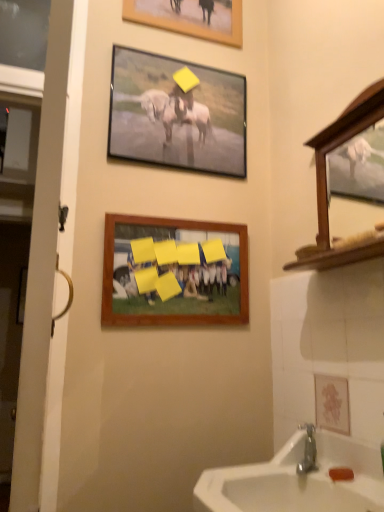
Question: From the image's perspective, is wooden picture frame at upper center, placed as the first picture frame when sorted from top to bottom, above metallic silver frame at upper center, which is the 2th picture frame from bottom to top?

Choices:
 (A) no
 (B) yes

Answer: (B)

Question: Is there a large distance between wooden picture frame at upper center, marked as the third picture frame in a bottom-to-top arrangement, and metallic silver frame at upper center, positioned as the 2th picture frame in top-to-bottom order?

Choices:
 (A) no
 (B) yes

Answer: (A)

Question: Is wooden picture frame at upper center, marked as the third picture frame in a bottom-to-top arrangement, oriented towards metallic silver frame at upper center, which is the 2th picture frame from bottom to top?

Choices:
 (A) no
 (B) yes

Answer: (A)

Question: Is wooden picture frame at upper center, marked as the third picture frame in a bottom-to-top arrangement, taller than metallic silver frame at upper center, which is the 2th picture frame from bottom to top?

Choices:
 (A) no
 (B) yes

Answer: (A)

Question: Is wooden picture frame at upper center, placed as the first picture frame when sorted from top to bottom, to the left of metallic silver frame at upper center, which is the 2th picture frame from bottom to top, from the viewer's perspective?

Choices:
 (A) no
 (B) yes

Answer: (A)

Question: In the image, is metallic silver frame at upper center, which is the 2th picture frame from bottom to top, positioned in front of or behind wooden picture frame at upper center, marked as the third picture frame in a bottom-to-top arrangement?

Choices:
 (A) behind
 (B) front

Answer: (B)

Question: From a real-world perspective, relative to wooden picture frame at upper center, marked as the third picture frame in a bottom-to-top arrangement, is metallic silver frame at upper center, which is the 2th picture frame from bottom to top, vertically above or below?

Choices:
 (A) below
 (B) above

Answer: (A)

Question: Is metallic silver frame at upper center, which is the 2th picture frame from bottom to top, wider or thinner than wooden picture frame at upper center, placed as the first picture frame when sorted from top to bottom?

Choices:
 (A) wide
 (B) thin

Answer: (A)

Question: From the image's perspective, is metallic silver frame at upper center, which is the 2th picture frame from bottom to top, located above or below wooden picture frame at upper center, marked as the third picture frame in a bottom-to-top arrangement?

Choices:
 (A) below
 (B) above

Answer: (A)

Question: From the image's perspective, is white wooden door at left positioned above or below metallic silver frame at upper center, which is the 2th picture frame from bottom to top?

Choices:
 (A) below
 (B) above

Answer: (A)

Question: Is white wooden door at left taller or shorter than metallic silver frame at upper center, positioned as the 2th picture frame in top-to-bottom order?

Choices:
 (A) short
 (B) tall

Answer: (B)

Question: Do you think white wooden door at left is within metallic silver frame at upper center, positioned as the 2th picture frame in top-to-bottom order, or outside of it?

Choices:
 (A) outside
 (B) inside

Answer: (A)

Question: Based on their positions, is white wooden door at left located to the left or right of metallic silver frame at upper center, positioned as the 2th picture frame in top-to-bottom order?

Choices:
 (A) left
 (B) right

Answer: (A)

Question: From a real-world perspective, is white wooden door at left positioned above or below wooden picture frame at center, which is counted as the first picture frame, starting from the bottom?

Choices:
 (A) above
 (B) below

Answer: (B)

Question: Based on their sizes in the image, would you say white wooden door at left is bigger or smaller than wooden picture frame at center, which is counted as the first picture frame, starting from the bottom?

Choices:
 (A) small
 (B) big

Answer: (B)